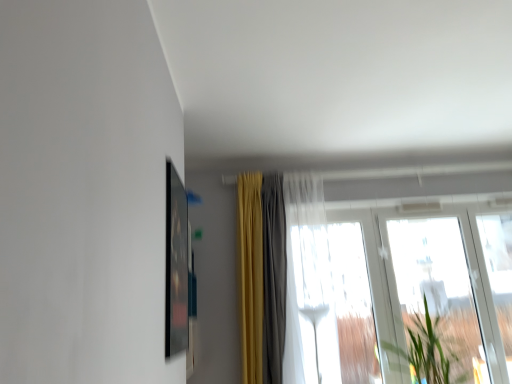
Identify the location of matte black picture frame at upper left. Image resolution: width=512 pixels, height=384 pixels. pyautogui.click(x=176, y=264).

Describe the element at coordinates (275, 267) in the screenshot. I see `yellow fabric curtain at center, the 1th curtain in the right-to-left sequence` at that location.

This screenshot has height=384, width=512. Describe the element at coordinates (403, 287) in the screenshot. I see `transparent glass window at center, the second window positioned from the left` at that location.

Image resolution: width=512 pixels, height=384 pixels. I want to click on transparent fabric at center, which appears as the first window when viewed from the left, so click(336, 305).

This screenshot has height=384, width=512. Describe the element at coordinates (250, 274) in the screenshot. I see `velvet yellow curtain at center, the second curtain from the right` at that location.

Where is `matte black picture frame at upper left`? This screenshot has height=384, width=512. matte black picture frame at upper left is located at coordinates (176, 264).

Does green leafy plant at right come behind velvet yellow curtain at center, the second curtain from the right?

No, the depth of green leafy plant at right is less than that of velvet yellow curtain at center, the second curtain from the right.

Considering the points (415, 378) and (256, 383), which point is behind, point (415, 378) or point (256, 383)?

The point (256, 383) is more distant.

Considering the relative sizes of green leafy plant at right and velvet yellow curtain at center, the second curtain from the right, in the image provided, is green leafy plant at right smaller than velvet yellow curtain at center, the second curtain from the right,?

No.

Is green leafy plant at right not close to velvet yellow curtain at center, which is the first curtain in left-to-right order?

green leafy plant at right is far away from velvet yellow curtain at center, which is the first curtain in left-to-right order.

Locate an element on the screen. This screenshot has height=384, width=512. picture frame located above the transparent glass window at center, the second window positioned from the right (from a real-world perspective) is located at coordinates (176, 264).

Is matte black picture frame at upper left positioned beyond the bounds of transparent glass window at center, the second window positioned from the right?

matte black picture frame at upper left is positioned outside transparent glass window at center, the second window positioned from the right.

Can you confirm if matte black picture frame at upper left is positioned to the right of transparent glass window at center, the second window positioned from the right?

No.

Considering the relative sizes of matte black picture frame at upper left and transparent glass window at center, the second window positioned from the left, in the image provided, is matte black picture frame at upper left shorter than transparent glass window at center, the second window positioned from the left,?

Correct, matte black picture frame at upper left is not as tall as transparent glass window at center, the second window positioned from the left.

Is transparent glass window at right, which is the third window from left to right, at the left side of transparent fabric at center, which appears as the first window when viewed from the left?

No, transparent glass window at right, which is the third window from left to right, is not to the left of transparent fabric at center, which appears as the first window when viewed from the left.

Considering the positions of objects transparent glass window at right, which appears as the first window when viewed from the right, and transparent fabric at center, which appears as the first window when viewed from the left, in the image provided, who is in front, transparent glass window at right, which appears as the first window when viewed from the right, or transparent fabric at center, which appears as the first window when viewed from the left,?

Positioned in front is transparent fabric at center, which appears as the first window when viewed from the left.

How far apart are transparent glass window at right, which is the third window from left to right, and transparent fabric at center, which appears as the first window when viewed from the left?

transparent glass window at right, which is the third window from left to right, is 23.01 inches from transparent fabric at center, which appears as the first window when viewed from the left.

From a real-world perspective, is transparent glass window at right, which is the third window from left to right, positioned over transparent fabric at center, which appears as the first window when viewed from the left, based on gravity?

No, from a real-world perspective, transparent glass window at right, which is the third window from left to right, is not over transparent fabric at center, which appears as the first window when viewed from the left

Can you confirm if transparent glass window at right, which appears as the first window when viewed from the right, is positioned to the left of matte black picture frame at upper left?

No, transparent glass window at right, which appears as the first window when viewed from the right, is not to the left of matte black picture frame at upper left.

Which of these two, transparent glass window at right, which appears as the first window when viewed from the right, or matte black picture frame at upper left, is bigger?

Bigger between the two is transparent glass window at right, which appears as the first window when viewed from the right.

This screenshot has height=384, width=512. I want to click on the 2nd window below when counting from the matte black picture frame at upper left (from the image's perspective), so click(x=436, y=303).

From the image's perspective, who appears lower, transparent glass window at center, the second window positioned from the right, or yellow fabric curtain at center, the 1th curtain in the right-to-left sequence?

transparent glass window at center, the second window positioned from the right, is shown below in the image.

Measure the distance between transparent glass window at center, the second window positioned from the left, and yellow fabric curtain at center, the 1th curtain in the right-to-left sequence.

transparent glass window at center, the second window positioned from the left, is 53.19 centimeters from yellow fabric curtain at center, the 1th curtain in the right-to-left sequence.

Who is more distant, transparent glass window at center, the second window positioned from the right, or yellow fabric curtain at center, the 1th curtain in the right-to-left sequence?

transparent glass window at center, the second window positioned from the right, is further from the camera.

Can you confirm if transparent glass window at center, the second window positioned from the left, is shorter than yellow fabric curtain at center, which appears as the second curtain when viewed from the left?

Correct, transparent glass window at center, the second window positioned from the left, is not as tall as yellow fabric curtain at center, which appears as the second curtain when viewed from the left.

Is velvet yellow curtain at center, which is the first curtain in left-to-right order, positioned with its back to transparent fabric at center, which is the 3th window in right-to-left order?

That's not correct — velvet yellow curtain at center, which is the first curtain in left-to-right order, is not looking away from transparent fabric at center, which is the 3th window in right-to-left order.

Is velvet yellow curtain at center, the second curtain from the right, wider or thinner than transparent fabric at center, which is the 3th window in right-to-left order?

In the image, velvet yellow curtain at center, the second curtain from the right, appears to be more narrow than transparent fabric at center, which is the 3th window in right-to-left order.

Is point (252, 184) farther from camera compared to point (348, 333)?

That is True.

How much distance is there between velvet yellow curtain at center, which is the first curtain in left-to-right order, and transparent fabric at center, which appears as the first window when viewed from the left?

They are 58.58 centimeters apart.

Is matte black picture frame at upper left next to transparent fabric at center, which appears as the first window when viewed from the left, and touching it?

matte black picture frame at upper left is not next to transparent fabric at center, which appears as the first window when viewed from the left, and they're not touching.

Between point (183, 187) and point (307, 322), which one is positioned behind?

Positioned behind is point (183, 187).

Considering the positions of objects matte black picture frame at upper left and transparent fabric at center, which appears as the first window when viewed from the left, in the image provided, who is more to the left, matte black picture frame at upper left or transparent fabric at center, which appears as the first window when viewed from the left,?

matte black picture frame at upper left.

Considering the relative sizes of matte black picture frame at upper left and transparent fabric at center, which is the 3th window in right-to-left order, in the image provided, is matte black picture frame at upper left bigger than transparent fabric at center, which is the 3th window in right-to-left order,?

No, matte black picture frame at upper left is not bigger than transparent fabric at center, which is the 3th window in right-to-left order.

Identify the location of the 2nd curtain located above the green leafy plant at right (from a real-world perspective). (250, 274).

From the matte black picture frame at upper left, count 2nd window to the right and point to it. Please provide its 2D coordinates.

[(403, 287)]

Based on their spatial positions, is yellow fabric curtain at center, which appears as the second curtain when viewed from the left, or transparent glass window at right, which is the third window from left to right, further from transparent glass window at center, the second window positioned from the left?

Based on the image, yellow fabric curtain at center, which appears as the second curtain when viewed from the left, appears to be further to transparent glass window at center, the second window positioned from the left.

Considering their positions, is transparent glass window at right, which appears as the first window when viewed from the right, positioned closer to transparent glass window at center, the second window positioned from the right, than yellow fabric curtain at center, the 1th curtain in the right-to-left sequence?

transparent glass window at right, which appears as the first window when viewed from the right, is positioned closer to the anchor transparent glass window at center, the second window positioned from the right.

Looking at the image, which one is located further to matte black picture frame at upper left, transparent glass window at right, which is the third window from left to right, or velvet yellow curtain at center, the second curtain from the right?

Based on the image, transparent glass window at right, which is the third window from left to right, appears to be further to matte black picture frame at upper left.

Considering their positions, is transparent glass window at center, the second window positioned from the right, positioned further to yellow fabric curtain at center, the 1th curtain in the right-to-left sequence, than velvet yellow curtain at center, the second curtain from the right?

The object further to yellow fabric curtain at center, the 1th curtain in the right-to-left sequence, is transparent glass window at center, the second window positioned from the right.

When comparing their distances from matte black picture frame at upper left, does yellow fabric curtain at center, which appears as the second curtain when viewed from the left, or transparent glass window at right, which appears as the first window when viewed from the right, seem further?

transparent glass window at right, which appears as the first window when viewed from the right, is further to matte black picture frame at upper left.

From the image, which object appears to be farther from transparent glass window at center, the second window positioned from the left, yellow fabric curtain at center, the 1th curtain in the right-to-left sequence, or velvet yellow curtain at center, the second curtain from the right?

velvet yellow curtain at center, the second curtain from the right, is positioned further to the anchor transparent glass window at center, the second window positioned from the left.

Considering their positions, is yellow fabric curtain at center, which appears as the second curtain when viewed from the left, positioned further to velvet yellow curtain at center, the second curtain from the right, than transparent glass window at right, which appears as the first window when viewed from the right?

Among the two, transparent glass window at right, which appears as the first window when viewed from the right, is located further to velvet yellow curtain at center, the second curtain from the right.

Which object lies further to the anchor point yellow fabric curtain at center, the 1th curtain in the right-to-left sequence, green leafy plant at right or transparent glass window at right, which is the third window from left to right?

green leafy plant at right is positioned further to the anchor yellow fabric curtain at center, the 1th curtain in the right-to-left sequence.

Identify the location of window positioned between matte black picture frame at upper left and velvet yellow curtain at center, the second curtain from the right, from near to far. The height and width of the screenshot is (384, 512). (336, 305).

The height and width of the screenshot is (384, 512). I want to click on curtain between velvet yellow curtain at center, the second curtain from the right, and transparent glass window at center, the second window positioned from the left, from left to right, so [275, 267].

I want to click on window situated between velvet yellow curtain at center, the second curtain from the right, and green leafy plant at right from left to right, so click(336, 305).

At what (x,y) coordinates should I click in order to perform the action: click on curtain between matte black picture frame at upper left and velvet yellow curtain at center, the second curtain from the right, along the z-axis. Please return your answer as a coordinate pair (x, y). The image size is (512, 384). Looking at the image, I should click on [275, 267].